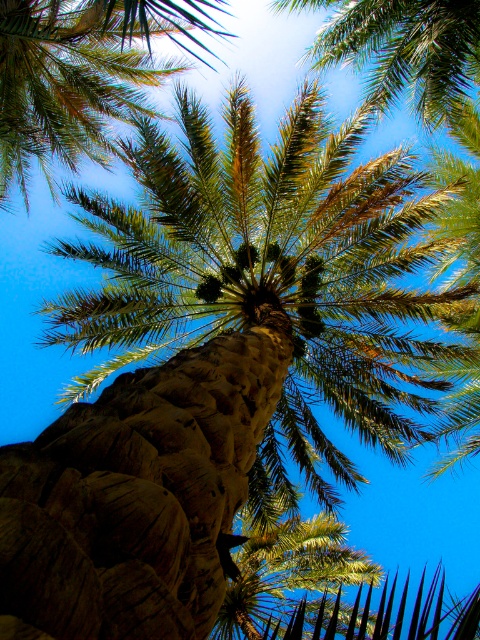
Question: Which point is closer to the camera?

Choices:
 (A) (35, 157)
 (B) (456, 92)

Answer: (B)

Question: Does green leafy palm at center have a smaller size compared to green leafy palm at upper center?

Choices:
 (A) no
 (B) yes

Answer: (A)

Question: Does green leafy palm at center have a smaller size compared to green leafy palm at upper center?

Choices:
 (A) yes
 (B) no

Answer: (B)

Question: Which point is farther to the camera?

Choices:
 (A) (405, 74)
 (B) (116, 109)

Answer: (B)

Question: Can you confirm if green leafy palm at center is smaller than green leafy palm at upper center?

Choices:
 (A) yes
 (B) no

Answer: (B)